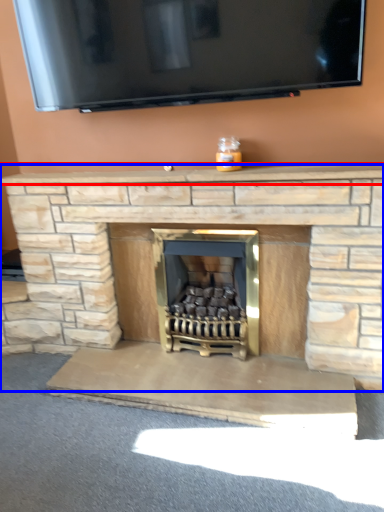
Question: Which point is closer to the camera, mantle (highlighted by a red box) or fireplace (highlighted by a blue box)?

Choices:
 (A) mantle
 (B) fireplace

Answer: (B)